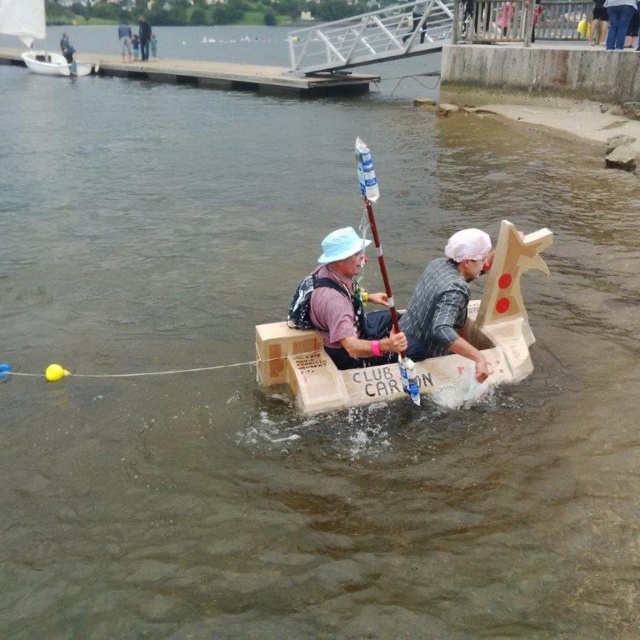
You are a participant in the cardboard boat race and want to navigate towards the finish line located at point (x=141, y=32). Your current position is at point (x=502, y=252). Based on the scene description, which direction should you paddle to move closer to the finish line?

Since point (x=502, y=252) is in front of point (x=141, y=32), you should paddle backward to move towards the finish line located at point (x=141, y=32).

You are a photographer standing on the shore of a lake. You want to take a photo of the cardboard boat at center from a distance that allows you to capture the entire boat and its occupants clearly. The minimum focusing distance of your camera is 6 meters. Will you need to adjust your position to take this photo?

The distance between the cardboard boat at center and the camera is 5.93 meters, which is less than the camera minimum focusing distance of 6 meters. Therefore, you will need to move further back to ensure the camera can focus properly on the cardboard boat at center.